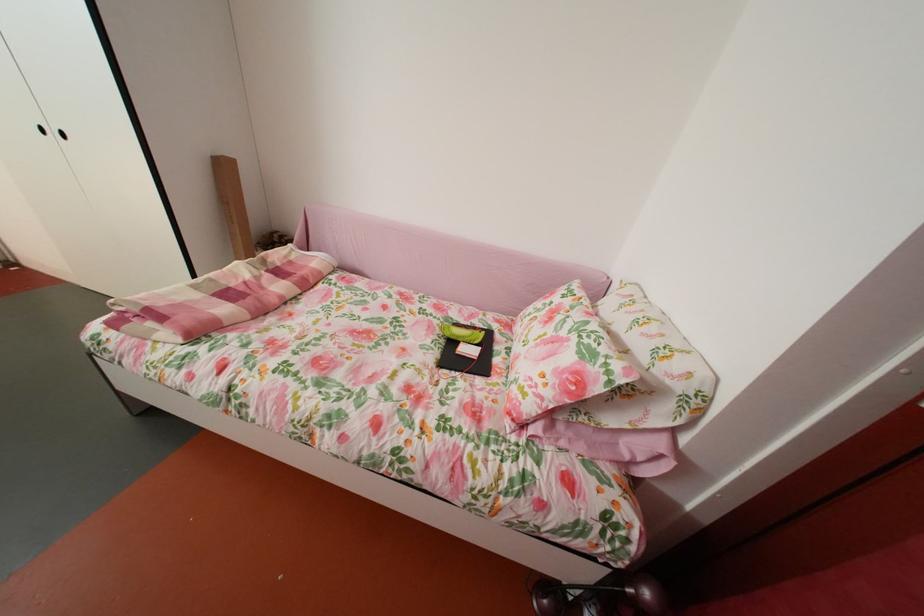
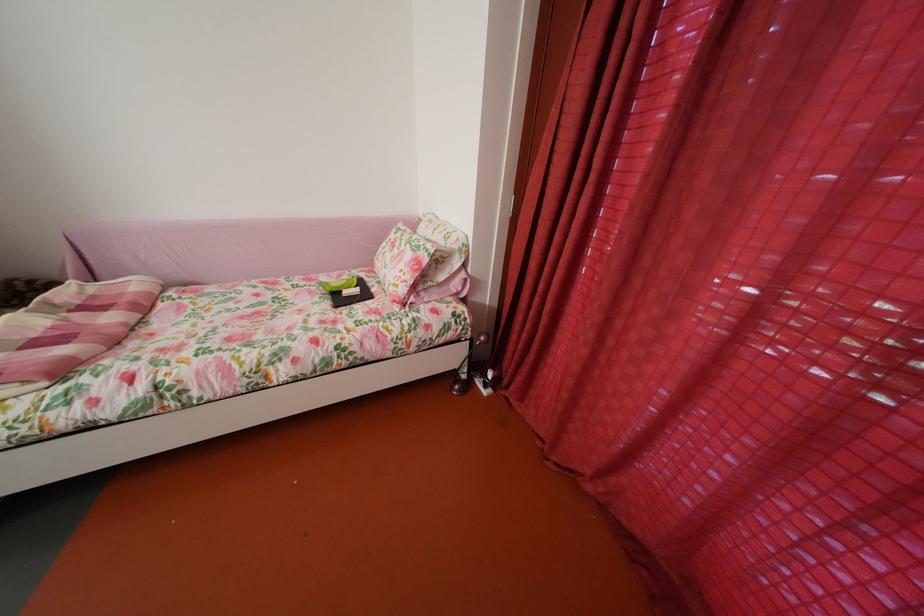
Find the pixel in the second image that matches pixel 626 569 in the first image.

(478, 339)